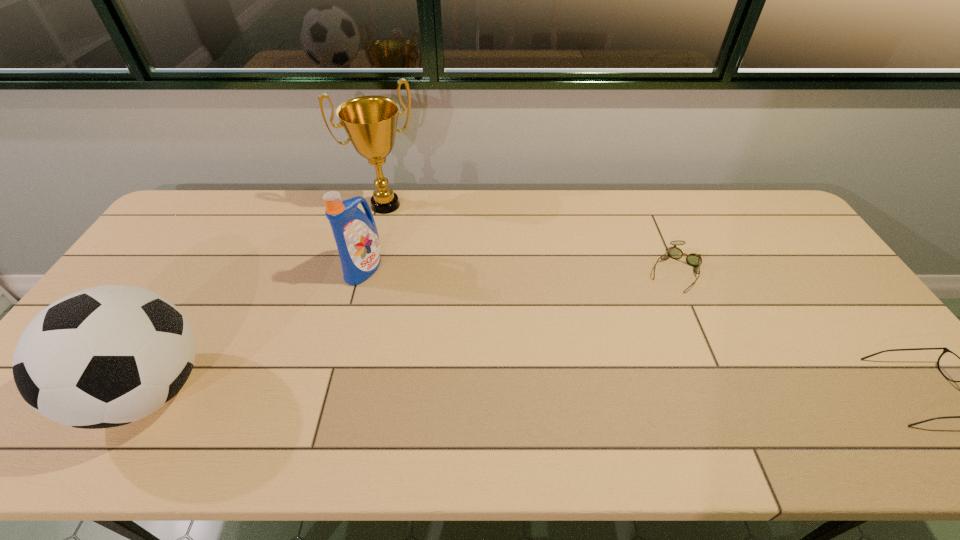
This screenshot has width=960, height=540. I want to click on free space located on the front-facing side of the shortest object, so click(651, 318).

You are a GUI agent. You are given a task and a screenshot of the screen. Output one action in this format:
    pyautogui.click(x=<x>, y=<y>)
    Task: Click on the free space located 0.340m on the front-facing side of the shortest object
    Image resolution: width=960 pixels, height=540 pixels.
    Given the screenshot: What is the action you would take?
    pyautogui.click(x=620, y=372)

Image resolution: width=960 pixels, height=540 pixels. What are the coordinates of `vacant position located 0.170m on the front-facing side of the shortest object` in the screenshot? It's located at click(646, 327).

At what (x,y) coordinates should I click in order to perform the action: click on free point located on the front view with handles of the award. Please return your answer as a coordinate pair (x, y). Looking at the image, I should click on (410, 243).

At what (x,y) coordinates should I click in order to perform the action: click on vacant region located on the front view with handles of the award. Please return your answer as a coordinate pair (x, y). This screenshot has width=960, height=540. Looking at the image, I should click on (429, 277).

Where is `vacant area situated on the front view with handles of the award`? This screenshot has width=960, height=540. vacant area situated on the front view with handles of the award is located at coordinates (403, 230).

Locate an element on the screen. Image resolution: width=960 pixels, height=540 pixels. object that is at the far edge is located at coordinates (370, 122).

At what (x,y) coordinates should I click in order to perform the action: click on object at the near edge. Please return your answer as a coordinate pair (x, y). The height and width of the screenshot is (540, 960). Looking at the image, I should click on (106, 356).

In order to click on object that is at the left edge in this screenshot , I will do `click(106, 356)`.

At what (x,y) coordinates should I click in order to perform the action: click on object present at the near left corner. Please return your answer as a coordinate pair (x, y). Image resolution: width=960 pixels, height=540 pixels. Looking at the image, I should click on (106, 356).